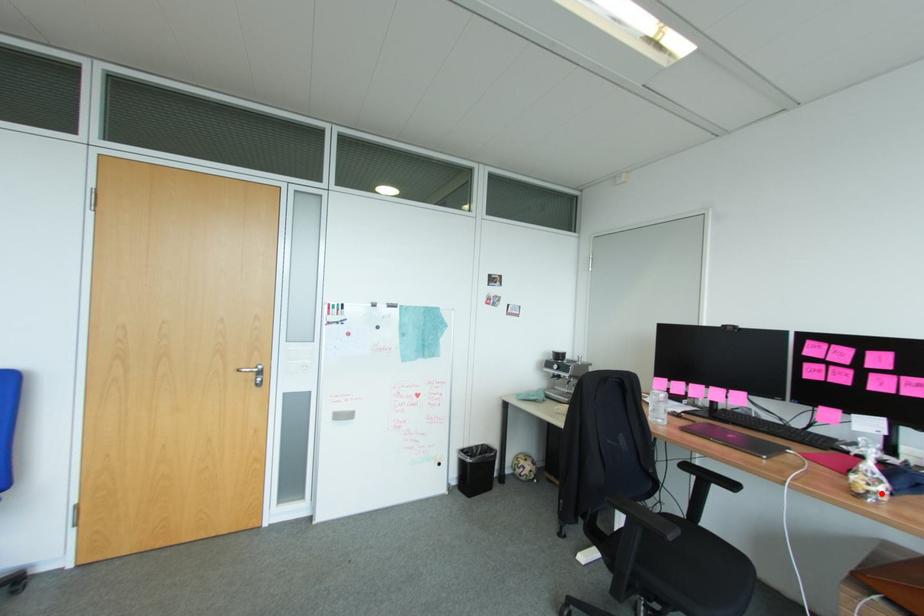
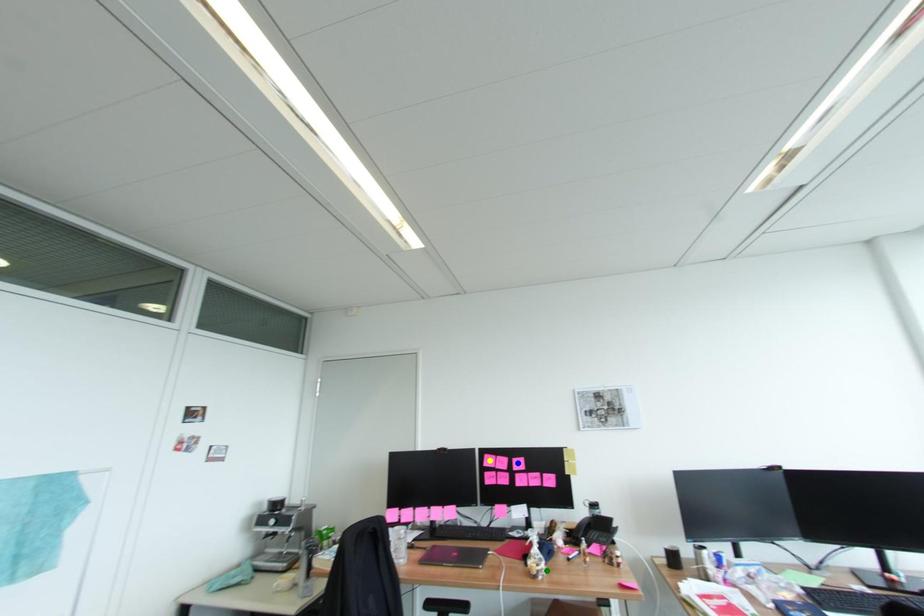
Question: I am providing you with two images of the same scene from different viewpoints. A red point is marked on the first image. You are given multiple points on the second image. In image 2, which mark is for the same physical point as the one in image 1?

Choices:
 (A) blue point
 (B) green point
 (C) yellow point

Answer: (B)